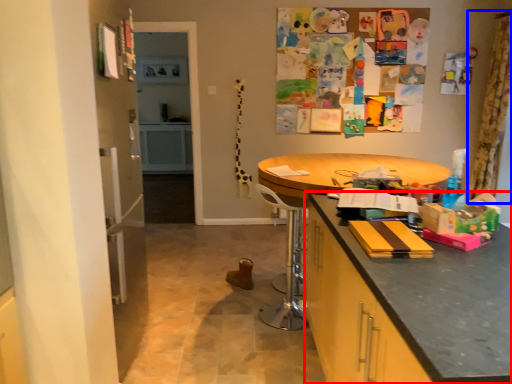
Question: Which point is further to the camera, cabinetry (highlighted by a red box) or curtain (highlighted by a blue box)?

Choices:
 (A) cabinetry
 (B) curtain

Answer: (B)